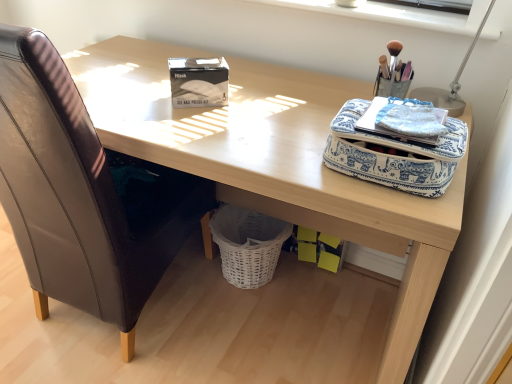
Locate an element on the screen. This screenshot has width=512, height=384. vacant area located to the right-hand side of white matte gel nail polish kit at upper center is located at coordinates (265, 104).